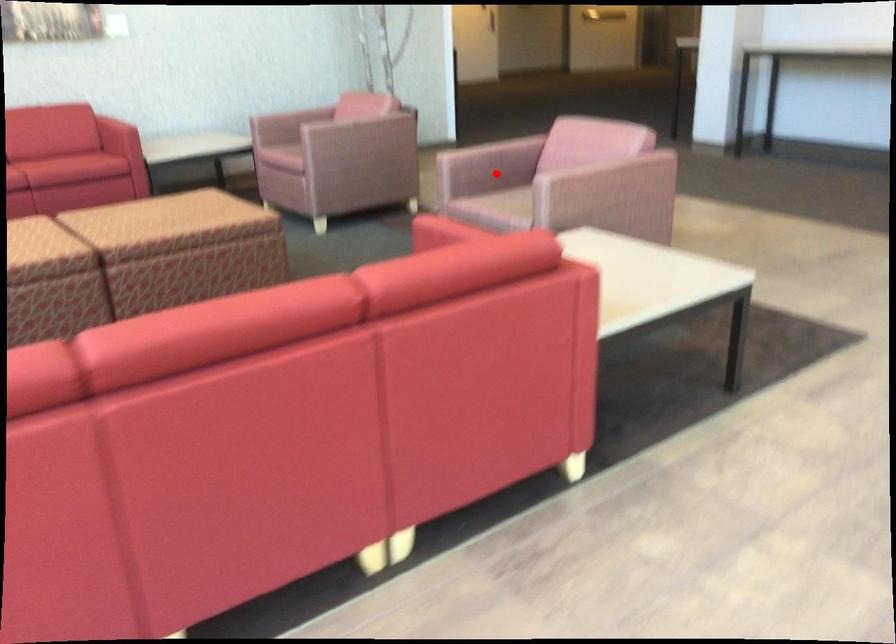
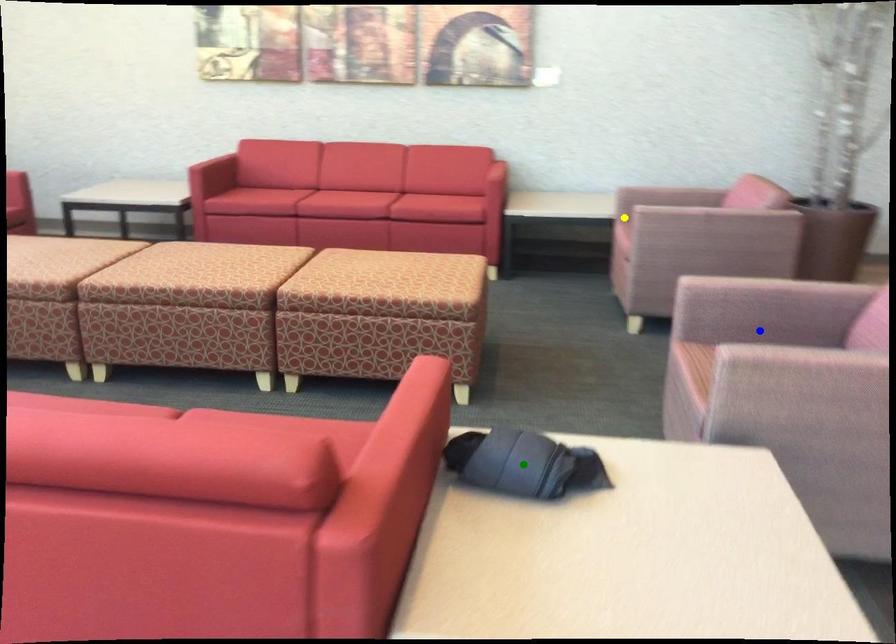
Question: I am providing you with two images of the same scene from different viewpoints. A red point is marked on the first image. You are given multiple points on the second image. Which mark in image 2 goes with the point in image 1?

Choices:
 (A) yellow point
 (B) green point
 (C) blue point

Answer: (C)